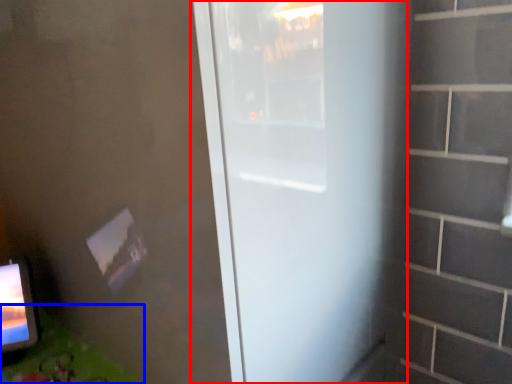
Question: Among these objects, which one is nearest to the camera, door (highlighted by a red box) or table (highlighted by a blue box)?

Choices:
 (A) door
 (B) table

Answer: (A)